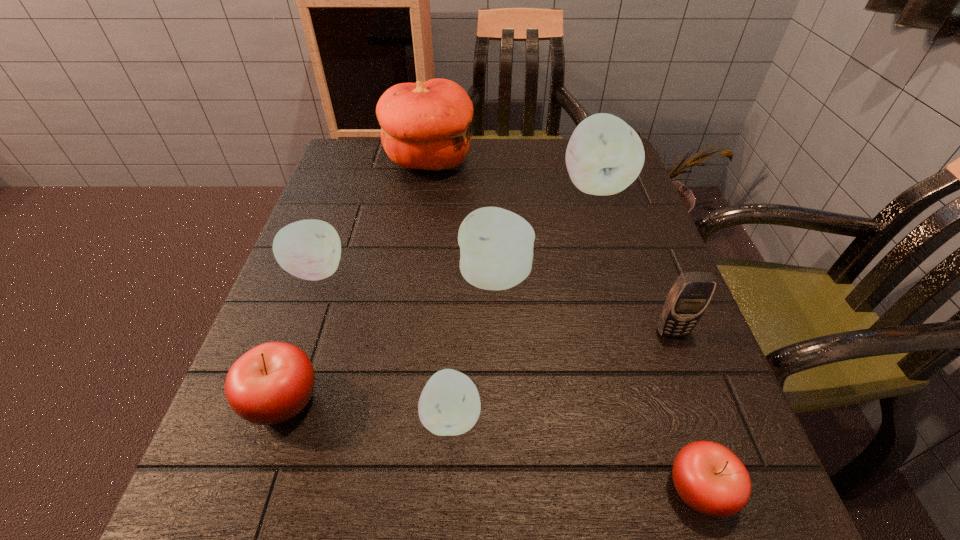
Where is `the nearest object`? The height and width of the screenshot is (540, 960). the nearest object is located at coordinates (709, 478).

The image size is (960, 540). I want to click on vacant space located 0.100m on the right of the pumpkin, so (512, 161).

Find the location of a particular element. free space located on the back of the biggest white apple is located at coordinates (584, 146).

The width and height of the screenshot is (960, 540). In order to click on vacant space positioned on the left of the second tallest apple in this screenshot , I will do `click(373, 278)`.

Image resolution: width=960 pixels, height=540 pixels. Identify the location of vacant space situated 0.260m on the front face of the cellular telephone. (734, 498).

Locate an element on the screen. This screenshot has height=540, width=960. vacant area located on the right of the third biggest white apple is located at coordinates (384, 271).

This screenshot has width=960, height=540. In order to click on vacant space located on the back of the bigger red apple in this screenshot , I will do `click(302, 342)`.

Find the location of a particular element. blank area located on the back of the smallest white apple is located at coordinates (457, 296).

Locate an element on the screen. The image size is (960, 540). free space located 0.140m on the left of the nearest apple is located at coordinates (563, 489).

The image size is (960, 540). Find the location of `pumpkin present at the far edge`. pumpkin present at the far edge is located at coordinates (425, 125).